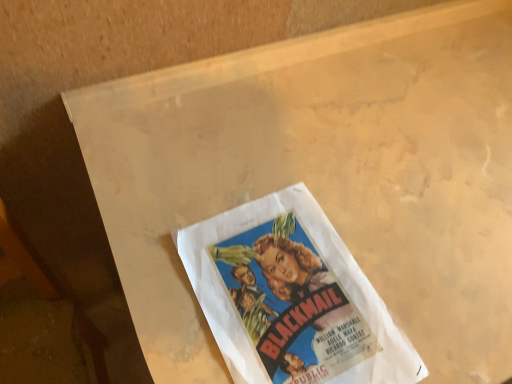
Image resolution: width=512 pixels, height=384 pixels. Find the location of `matte paper poster at center`. matte paper poster at center is located at coordinates (292, 297).

Image resolution: width=512 pixels, height=384 pixels. What do you see at coordinates (292, 297) in the screenshot? I see `matte paper poster at center` at bounding box center [292, 297].

This screenshot has width=512, height=384. Find the location of `matte paper poster at center`. matte paper poster at center is located at coordinates (292, 297).